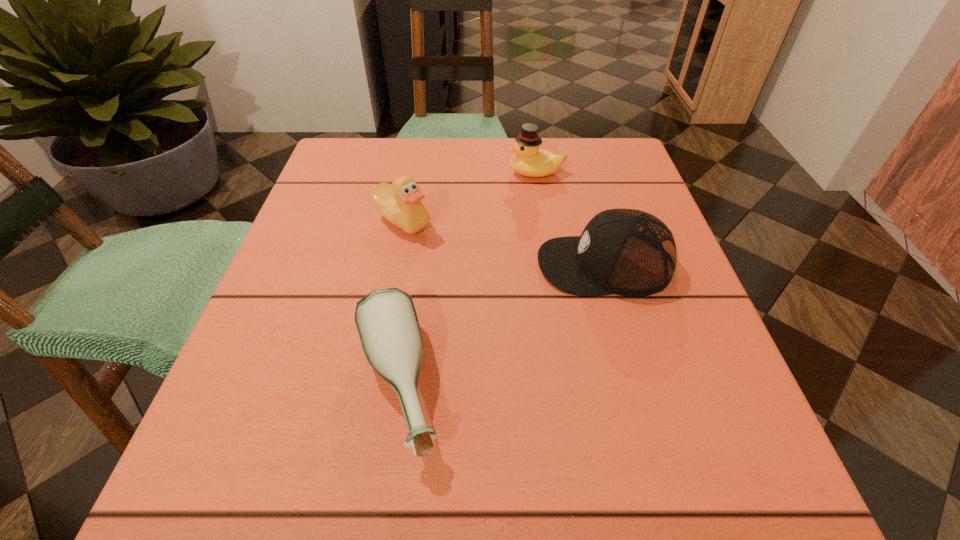
Image resolution: width=960 pixels, height=540 pixels. In order to click on vacant area that lies between the bottle and the cap in this screenshot , I will do `click(499, 325)`.

Identify the location of empty location between the farthest object and the bottle. (466, 279).

Locate an element on the screen. blank region between the shortest object and the cap is located at coordinates (499, 325).

Identify the location of free space that is in between the left duck and the cap. (503, 242).

What are the coordinates of `object that is the second nearest to the right duck` in the screenshot? It's located at (627, 252).

This screenshot has width=960, height=540. I want to click on the closest object relative to the nearer duck, so click(x=529, y=160).

Find the location of a particular element. This screenshot has width=960, height=540. free point that satisfies the following two spatial constraints: 1. at the beak of the nearest object; 2. on the left side of the left duck is located at coordinates (371, 386).

At what (x,y) coordinates should I click in order to perform the action: click on vacant space that satisfies the following two spatial constraints: 1. at the beak of the left duck; 2. on the right side of the shortest object. Please return your answer as a coordinate pair (x, y). Looking at the image, I should click on (371, 386).